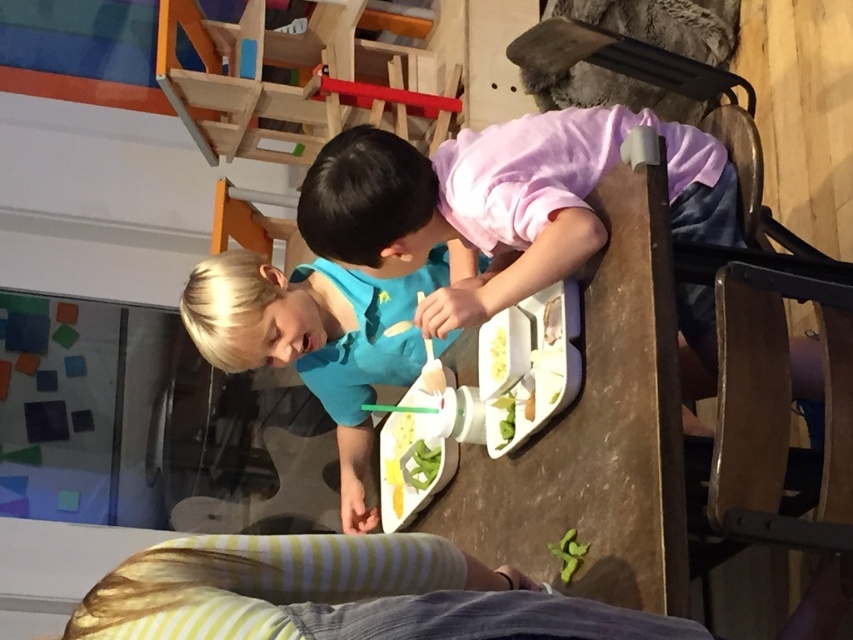
Question: Is blue matte shirt at center wider than green matte vegetable at center?

Choices:
 (A) yes
 (B) no

Answer: (A)

Question: Among these objects, which one is farthest from the camera?

Choices:
 (A) white matte plate at center
 (B) blue matte shirt at center

Answer: (A)

Question: Estimate the real-world distances between objects in this image. Which object is closer to the blue matte shirt at center?

Choices:
 (A) white matte food at center
 (B) green matte vegetable at center
 (C) white matte plate at center

Answer: (A)

Question: Can you confirm if green matte vegetable at center is bigger than white matte plate at center?

Choices:
 (A) no
 (B) yes

Answer: (B)

Question: Is green matte vegetable at center to the left of white matte food at center from the viewer's perspective?

Choices:
 (A) yes
 (B) no

Answer: (A)

Question: Which object is the farthest from the white matte plate at center?

Choices:
 (A) white matte food at center
 (B) green matte vegetable at center

Answer: (B)